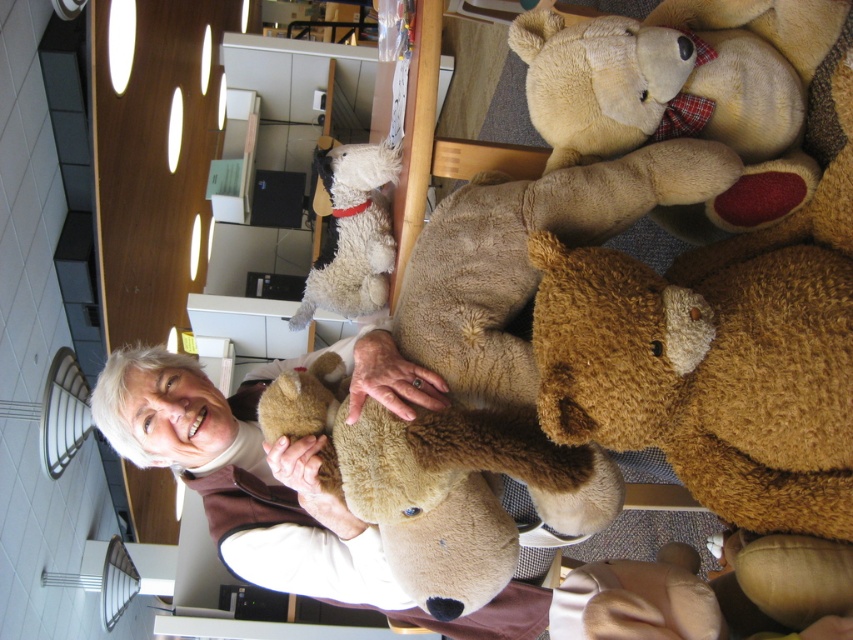
From the picture: You are a visitor in the library and want to take a photo of the brown plush teddy bear at center without the soft beige teddy bear at upper right appearing in the background. Is this possible based on their positions?

The brown plush teddy bear at center is in front of the soft beige teddy bear at upper right, so taking a photo from the current angle would show the brown plush teddy bear at center blocking the soft beige teddy bear at upper right, making it possible to capture the desired shot without the beige one in the background.

You are organizing a display in the library and need to place the soft beige teddy bear at upper right and the fuzzy beige dog at upper center on a shelf. Which one should you place first if you want to ensure both fit properly?

You should place the soft beige teddy bear at upper right first because it is bigger than the fuzzy beige dog at upper center, so positioning it first ensures there is enough space for both.

You are a delivery person who needs to place both the soft beige teddy bear at upper right and the fuzzy beige dog at upper center on a shelf that can only hold items up to 1 meter in height. Based on the scene description, will both items fit on the shelf?

The soft beige teddy bear at upper right is much taller than the fuzzy beige dog at upper center. Since the shelf can only hold items up to 1 meter in height, we need to know the exact height of the taller item to determine if it fits. However, the description does not provide specific measurements, so we cannot confirm if both items will fit on the shelf.